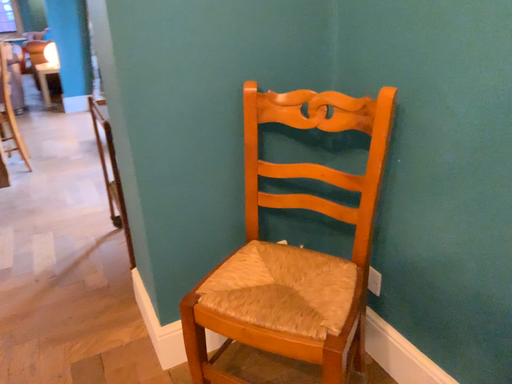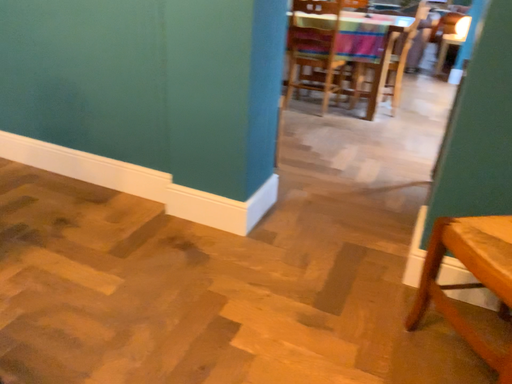
Question: Which way did the camera rotate in the video?

Choices:
 (A) rotated left
 (B) rotated right

Answer: (A)